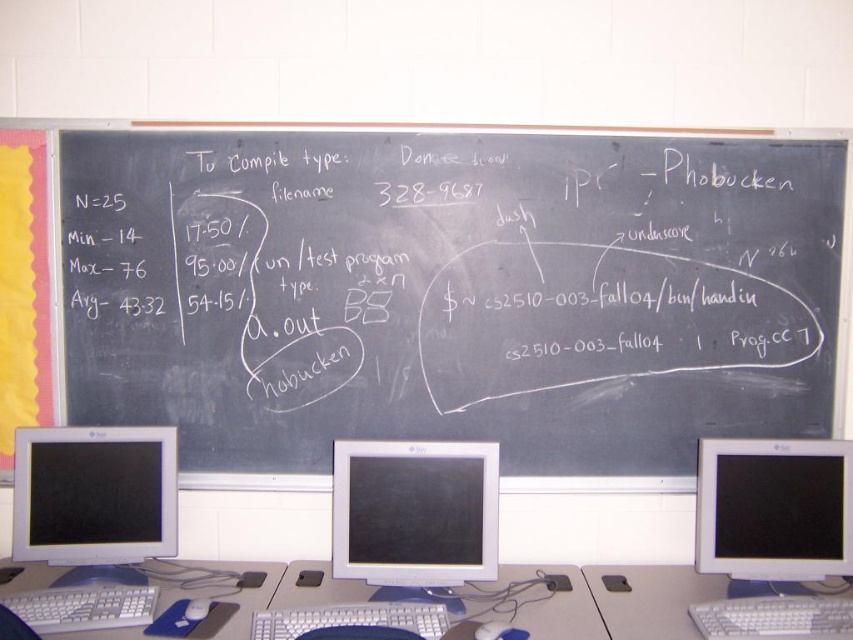
You are a student in the classroom and need to check the output of your program on the matte white monitor at center and the white plastic keyboard at lower left. Which object is taller?

The matte white monitor at center is taller than the white plastic keyboard at lower left.

You are a student who needs to locate your mouse to start working on a programming assignment. You see the white plastic table at center and the matte black mouse at center. Which object is located to the right of the other?

The white plastic table at center is positioned on the right side of matte black mouse at center, so the white plastic table at center is to the right of the matte black mouse at center.

From the picture: You are a student sitting at the desk in the classroom and need to reach both the black chalkboard at center and the white plastic keyboard at lower left. Which object is closer to your current position?

The white plastic keyboard at lower left is closer to your current position because it is located at the lower left, which is typically near the student, while the black chalkboard at center is positioned further away at the center of the room.